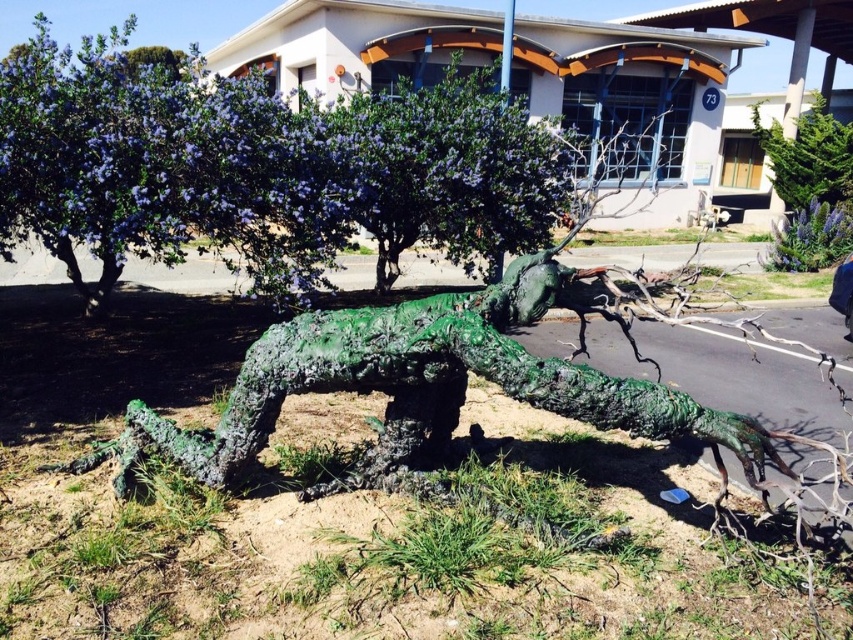
You are standing in front of the sculpture and want to touch the two points on it. The first point is at coordinates point (109,118) and the second is at point (837,205). Which point will you reach first if you move towards them?

You will reach the point (109,118) first because it is closer to you than the point (837,205).

In the scene shown: You are standing 6 feet away from the green textured sculpture at center. Can you reach it without moving?

The distance between you and the green textured sculpture at center is 6.89 feet, so you cannot reach it without moving closer since you are only 6 feet away.

You are standing in front of the sculpture and want to take a photo of the green matte tree at upper center. If your camera can focus on objects up to 6 meters away, will you need to move closer or farther away to capture it clearly?

The green matte tree at upper center is 6.34 meters away, which is beyond the camera focus range of 6 meters. Therefore, you need to move closer to the green matte tree at upper center to ensure it is within the camera focus range.